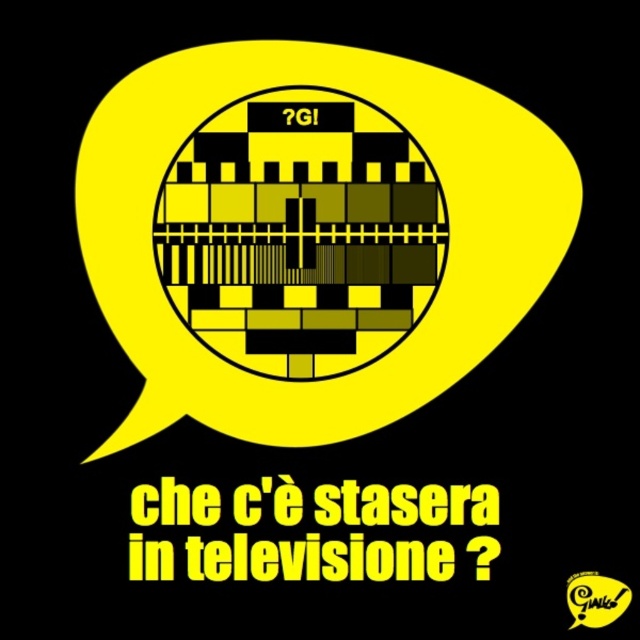
Question: From the image, what is the correct spatial relationship of yellow matte/black textured square at center in relation to yellow rubber speech bubble at center?

Choices:
 (A) right
 (B) left

Answer: (B)

Question: Which is nearer to the black pixelated qr code at center?

Choices:
 (A) yellow rubber speech bubble at center
 (B) yellow matte/black textured square at center

Answer: (B)

Question: In this image, where is yellow matte/black textured square at center located relative to black pixelated qr code at center?

Choices:
 (A) right
 (B) left

Answer: (B)

Question: Can you confirm if yellow matte/black textured square at center is positioned to the left of yellow rubber speech bubble at center?

Choices:
 (A) yes
 (B) no

Answer: (A)

Question: Based on their relative distances, which object is farther from the yellow rubber speech bubble at center?

Choices:
 (A) yellow matte/black textured square at center
 (B) black pixelated qr code at center

Answer: (A)

Question: Which point appears farthest from the camera in this image?

Choices:
 (A) (285, 376)
 (B) (145, 564)

Answer: (A)